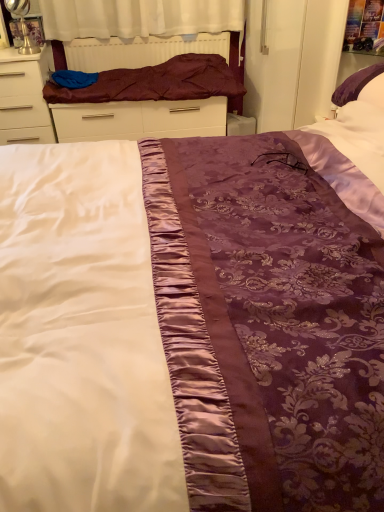
Find the location of a particular element. Image resolution: width=384 pixels, height=512 pixels. free space above maroon satin bed frame at upper center (from a real-world perspective) is located at coordinates (159, 33).